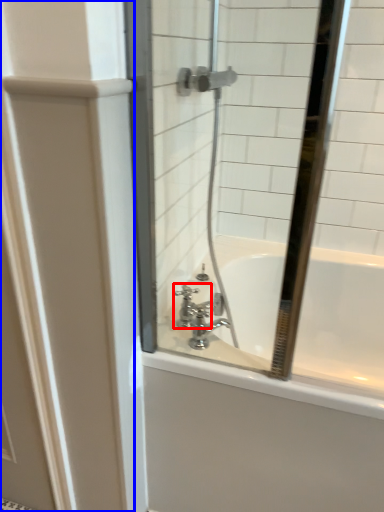
Question: Which of the following is the farthest to the observer, faucet (highlighted by a red box) or screen door (highlighted by a blue box)?

Choices:
 (A) faucet
 (B) screen door

Answer: (A)